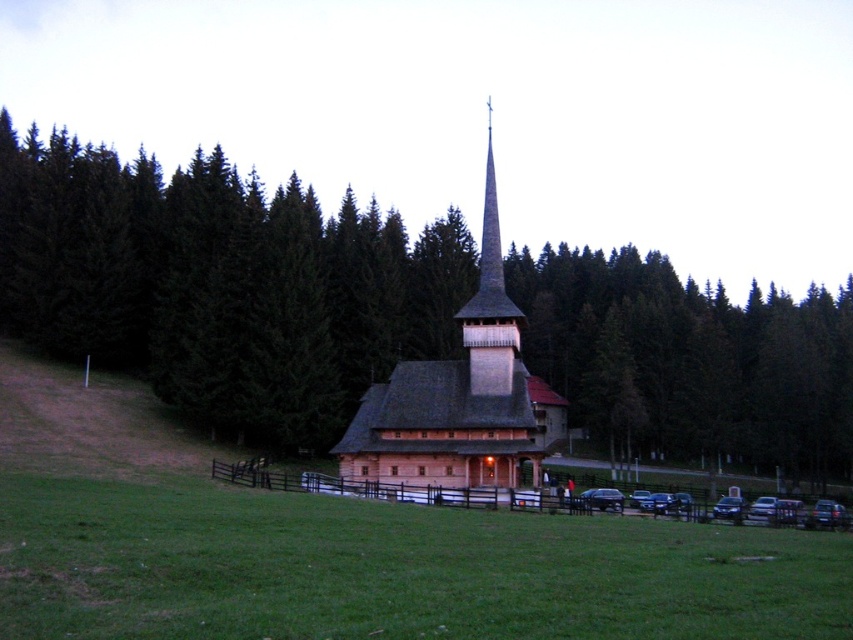
Question: Where is green grass at lower center located in relation to wooden spire at center in the image?

Choices:
 (A) below
 (B) above

Answer: (A)

Question: Which object appears farthest from the camera in this image?

Choices:
 (A) green textured pine tree at center
 (B) green grass at lower center
 (C) wooden church at center
 (D) wooden spire at center

Answer: (A)

Question: Does wooden church at center have a larger size compared to wooden spire at center?

Choices:
 (A) yes
 (B) no

Answer: (A)

Question: Among these objects, which one is nearest to the camera?

Choices:
 (A) green textured pine tree at center
 (B) wooden church at center
 (C) wooden spire at center
 (D) green grass at lower center

Answer: (D)

Question: Is green grass at lower center bigger than wooden spire at center?

Choices:
 (A) no
 (B) yes

Answer: (A)

Question: Which object appears closest to the camera in this image?

Choices:
 (A) green grass at lower center
 (B) wooden church at center

Answer: (A)